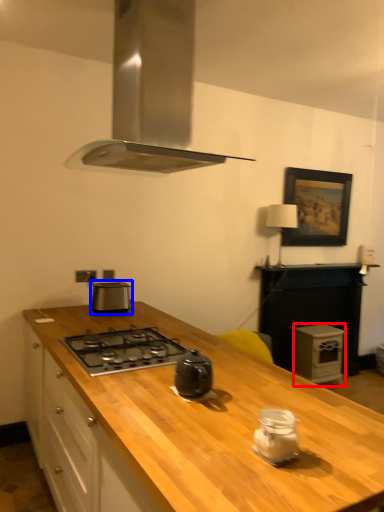
Question: Among these objects, which one is farthest to the camera, appliance (highlighted by a red box) or kitchen appliance (highlighted by a blue box)?

Choices:
 (A) appliance
 (B) kitchen appliance

Answer: (A)